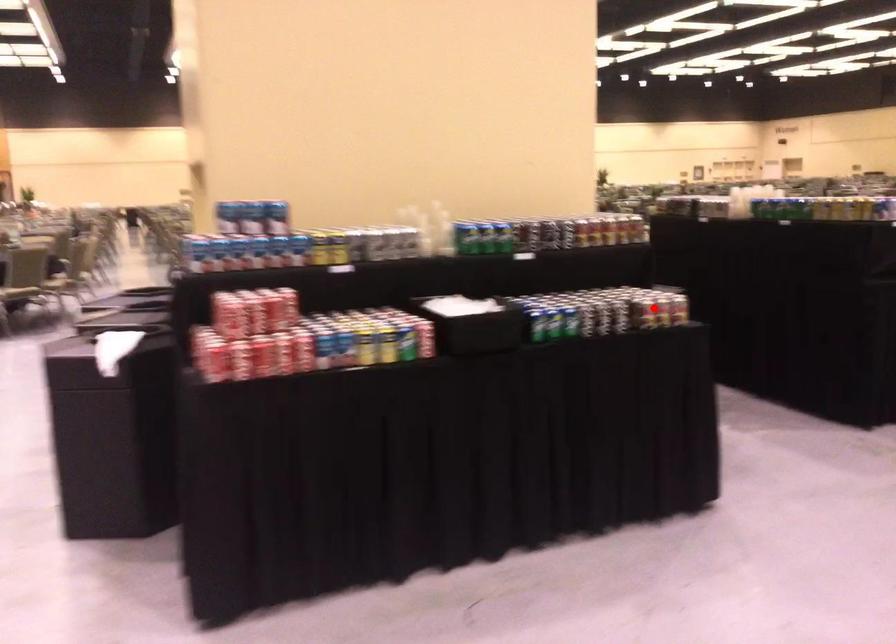
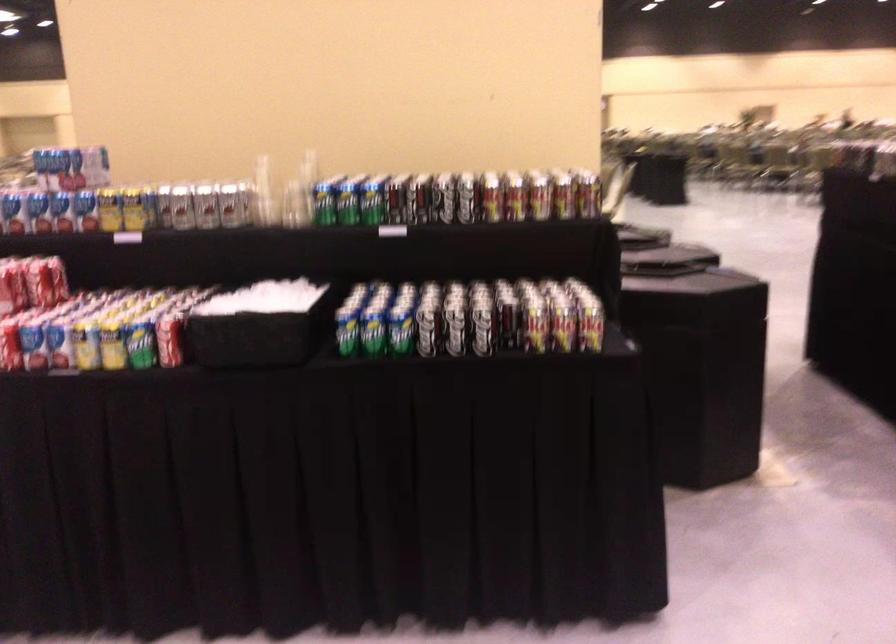
The point at the highlighted location is marked in the first image. Where is the corresponding point in the second image?

(533, 323)